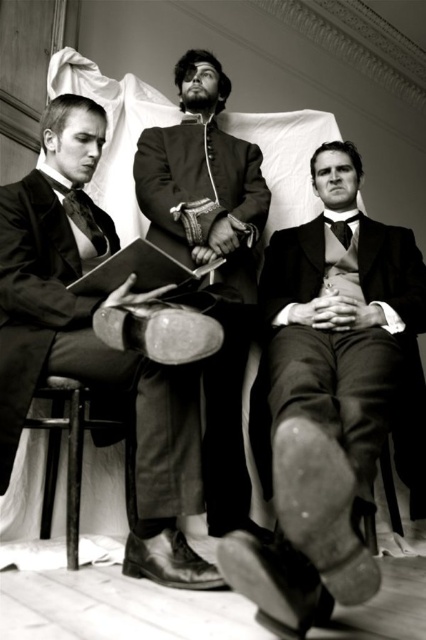
Is point (143, 384) positioned behind point (74, 202)?

No, it is in front of (74, 202).

Image resolution: width=426 pixels, height=640 pixels. What do you see at coordinates (92, 342) in the screenshot?
I see `matte black suit at center` at bounding box center [92, 342].

Is point (14, 196) less distant than point (68, 188)?

Yes, point (14, 196) is closer to viewer.

Find the location of a particular element. The height and width of the screenshot is (640, 426). matte black suit at center is located at coordinates (92, 342).

Between matte black suit at center and black satin bow tie at center, which one is positioned higher?

black satin bow tie at center is above.

Does matte black suit at center appear under black satin bow tie at center?

Yes.

What do you see at coordinates (92, 342) in the screenshot? This screenshot has height=640, width=426. I see `matte black suit at center` at bounding box center [92, 342].

Where is `matte black suit at center`? The width and height of the screenshot is (426, 640). matte black suit at center is located at coordinates (92, 342).

Is matte black tie at center to the right of black satin bow tie at center from the viewer's perspective?

No, matte black tie at center is not to the right of black satin bow tie at center.

Can you confirm if matte black tie at center is taller than black satin bow tie at center?

Yes.

Which is in front, point (60, 184) or point (354, 216)?

Point (60, 184)

Identify the location of matte black tie at center. (80, 218).